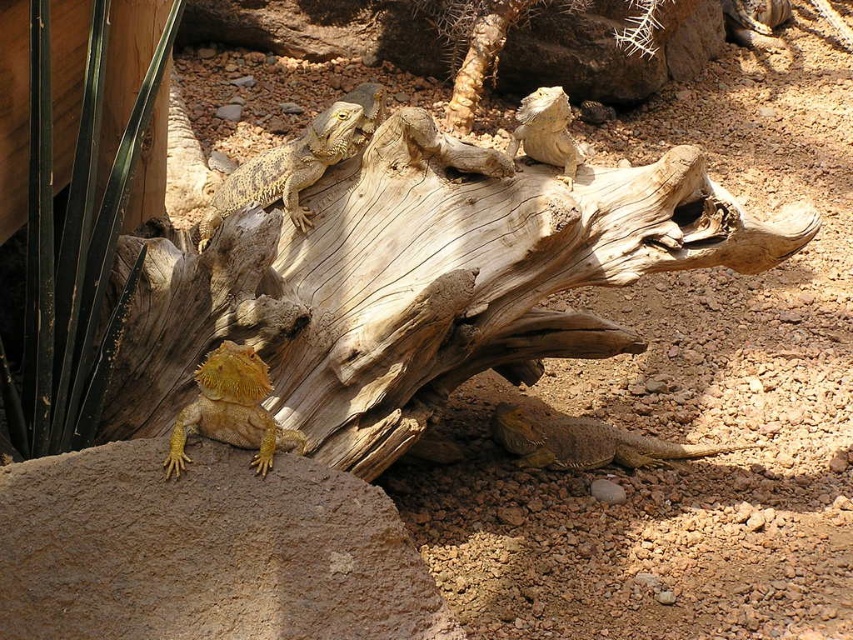
You are observing the desert scene and need to locate the yellow scaly lizard at lower left. Based on the coordinates provided, can you determine its position relative to the central driftwood?

The yellow scaly lizard at lower left is located at coordinates point (231,410), which places it near the lower left area of the image, away from the central driftwood.